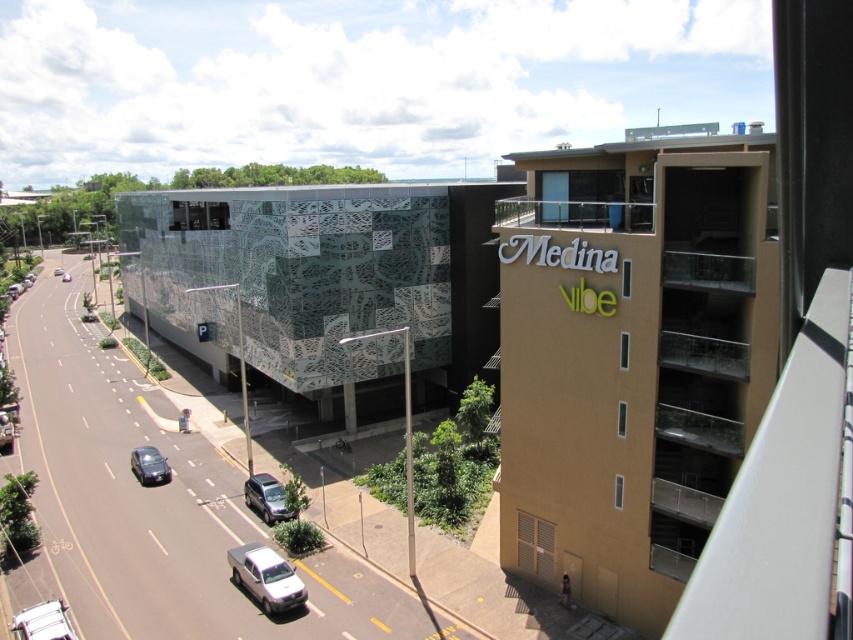
Is silver metallic pickup truck at lower center wider than silver metallic car at center?

No, silver metallic pickup truck at lower center is not wider than silver metallic car at center.

Can you confirm if silver metallic pickup truck at lower center is positioned above silver metallic car at center?

Actually, silver metallic pickup truck at lower center is below silver metallic car at center.

From the picture: Who is more distant from viewer, (263, 570) or (55, 268)?

Point (55, 268)

Identify the location of silver metallic pickup truck at lower center. The image size is (853, 640). click(265, 577).

Does silver metallic pickup truck at lower center have a larger size compared to white matte car at lower left?

Indeed, silver metallic pickup truck at lower center has a larger size compared to white matte car at lower left.

Who is positioned more to the right, silver metallic pickup truck at lower center or white matte car at lower left?

From the viewer's perspective, silver metallic pickup truck at lower center appears more on the right side.

Between point (250, 541) and point (57, 611), which one is positioned behind?

The point (250, 541) is more distant.

The image size is (853, 640). In order to click on silver metallic pickup truck at lower center in this screenshot , I will do `click(265, 577)`.

Can you confirm if white matte car at lower left is positioned below metallic silver suv at center?

Indeed, white matte car at lower left is positioned under metallic silver suv at center.

Which is more to the right, white matte car at lower left or metallic silver suv at center?

metallic silver suv at center

Is point (50, 614) more distant than point (244, 500)?

That is False.

You are a GUI agent. You are given a task and a screenshot of the screen. Output one action in this format:
    pyautogui.click(x=<x>, y=<y>)
    Task: Click on the white matte car at lower left
    The height and width of the screenshot is (640, 853).
    Given the screenshot: What is the action you would take?
    pyautogui.click(x=44, y=621)